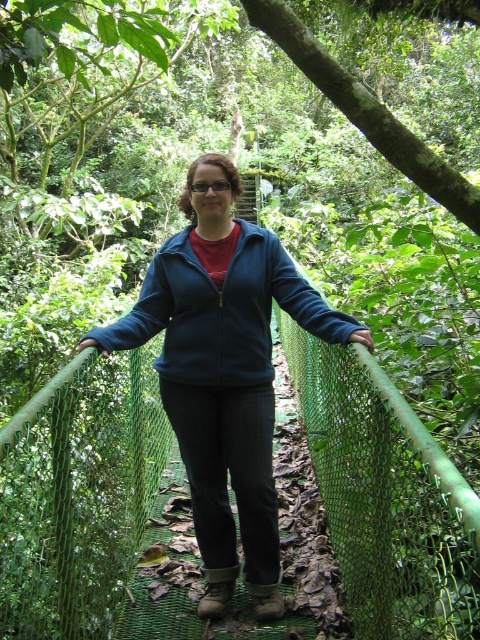
You are a photographer trying to capture the person in the blue fleece jacket at center. If you want to position the jacket exactly at the center of your camera frame, which has a coordinate system where the bottom left corner is at point 0,0 and the top right corner is at point 1,1, what are the coordinates you should aim for?

The coordinates to aim for are [224,372], as the blue fleece jacket at center is located at that point in the image.

You are standing on the walkway and want to move from the point at coordinates point [212,509] to the point at coordinates point [154,266]. Which direction should you move to get closer to the latter?

You should move towards the point at coordinates point [154,266], which is closer to you than the starting point at point [212,509]. Since point [154,266] is nearer, moving toward it will bring you closer.